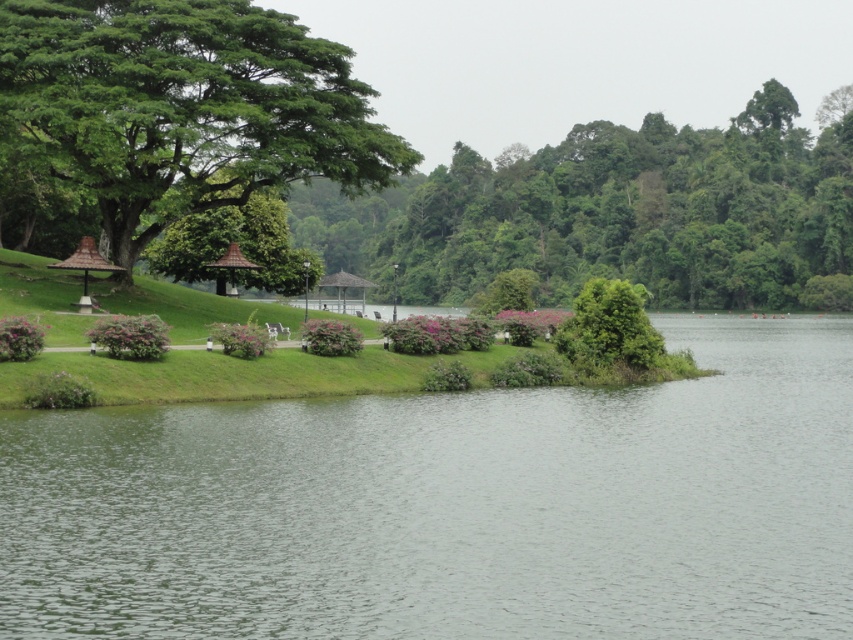
How far apart are clear water at center and brown thatched roof gazebo at center?

The distance of clear water at center from brown thatched roof gazebo at center is 26.12 meters.

Is clear water at center below brown thatched roof gazebo at center?

Correct, clear water at center is located below brown thatched roof gazebo at center.

Does point (548, 444) come in front of point (260, 268)?

Yes, point (548, 444) is closer to viewer.

This screenshot has height=640, width=853. What are the coordinates of `clear water at center` in the screenshot? It's located at (451, 506).

Which is below, green leafy tree at upper left or brown thatched roof gazebo at left?

brown thatched roof gazebo at left is lower down.

Between point (148, 166) and point (71, 262), which one is positioned in front?

Point (71, 262) is more forward.

The height and width of the screenshot is (640, 853). Identify the location of green leafy tree at upper left. (183, 108).

In the scene shown: Does green leafy tree at upper left have a lesser width compared to wooden gazebo at center?

Indeed, green leafy tree at upper left has a lesser width compared to wooden gazebo at center.

Can you confirm if green leafy tree at upper left is positioned to the left of wooden gazebo at center?

In fact, green leafy tree at upper left is to the right of wooden gazebo at center.

Find the location of a particular element. green leafy tree at upper left is located at coordinates (183, 108).